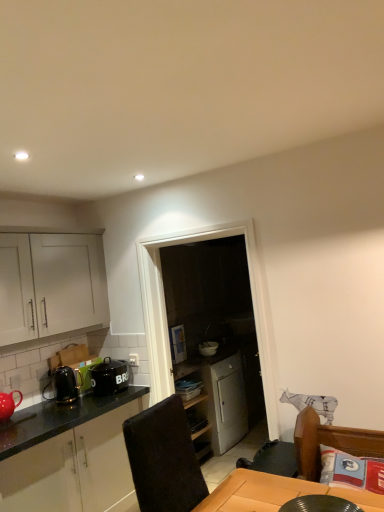
Question: Which direction should I rotate to look at white glossy bowl at center, which is the 2th appliance from left to right?

Choices:
 (A) left
 (B) right

Answer: (B)

Question: Can you confirm if shiny black kettle at left, which appears as the third appliance when viewed from the right, is positioned to the left of matte red teapot at lower left?

Choices:
 (A) yes
 (B) no

Answer: (B)

Question: Considering the relative sizes of shiny black kettle at left, the second appliance viewed from the front, and matte red teapot at lower left in the image provided, is shiny black kettle at left, the second appliance viewed from the front, taller than matte red teapot at lower left?

Choices:
 (A) yes
 (B) no

Answer: (A)

Question: Can you confirm if shiny black kettle at left, the second appliance viewed from the front, is positioned to the right of matte red teapot at lower left?

Choices:
 (A) no
 (B) yes

Answer: (B)

Question: Would you say matte red teapot at lower left is part of shiny black kettle at left, placed as the 2th appliance when sorted from back to front,'s contents?

Choices:
 (A) no
 (B) yes

Answer: (A)

Question: Is shiny black kettle at left, the second appliance viewed from the front, positioned behind matte red teapot at lower left?

Choices:
 (A) yes
 (B) no

Answer: (A)

Question: Considering the relative sizes of shiny black kettle at left, the second appliance viewed from the front, and matte red teapot at lower left in the image provided, is shiny black kettle at left, the second appliance viewed from the front, smaller than matte red teapot at lower left?

Choices:
 (A) no
 (B) yes

Answer: (B)

Question: Is matte red teapot at lower left positioned behind brown leather swivel chair at lower right?

Choices:
 (A) yes
 (B) no

Answer: (A)

Question: Does matte red teapot at lower left come in front of brown leather swivel chair at lower right?

Choices:
 (A) no
 (B) yes

Answer: (A)

Question: Is matte red teapot at lower left shorter than brown leather swivel chair at lower right?

Choices:
 (A) no
 (B) yes

Answer: (B)

Question: Can you see matte red teapot at lower left touching brown leather swivel chair at lower right?

Choices:
 (A) yes
 (B) no

Answer: (B)

Question: Is matte red teapot at lower left thinner than brown leather swivel chair at lower right?

Choices:
 (A) no
 (B) yes

Answer: (B)

Question: From a real-world perspective, is matte red teapot at lower left positioned over brown leather swivel chair at lower right based on gravity?

Choices:
 (A) yes
 (B) no

Answer: (A)

Question: Considering the relative positions of black glossy plate at lower center, the 3th appliance when ordered from left to right, and brown leather swivel chair at lower right in the image provided, is black glossy plate at lower center, the 3th appliance when ordered from left to right, to the left of brown leather swivel chair at lower right from the viewer's perspective?

Choices:
 (A) yes
 (B) no

Answer: (A)